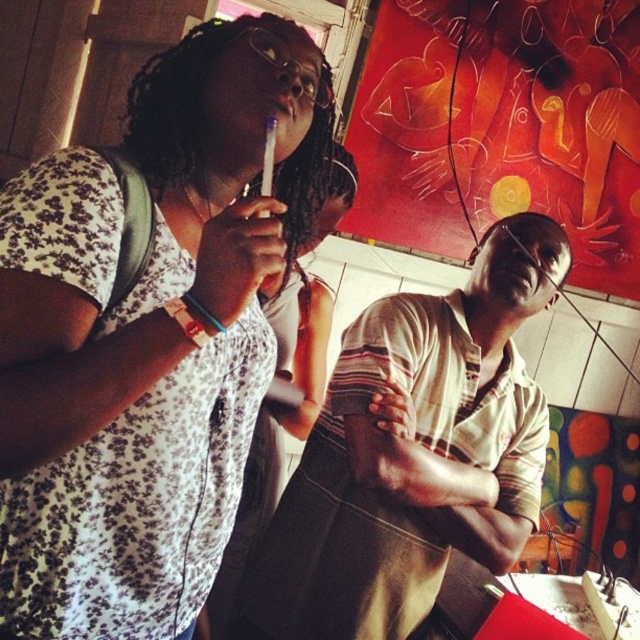
You are organizing a clothing donation drive and need to categorize items by size. You have two garments in front of you, the floral fabric dress at upper left and the matte black shirt at center. Based on their thickness, which one should you place in the small size section?

The floral fabric dress at upper left is thinner than the matte black shirt at center, so it should be placed in the small size section.

You are a photographer trying to capture a candid shot of both the woman in the floral fabric dress at upper left and the other person in the scene. The minimum distance required for your camera to focus on both subjects clearly is 30 inches. Can you take the photo without moving either subject?

The two subjects are 28.23 inches apart, which is less than the camera minimum focusing distance of 30 inches. Therefore, you can take the photo without moving the subjects because they are close enough.

You are standing in the scene and want to reach both points, point (x=182, y=497) and point (x=294, y=100). Which point should you move towards first if you want to reach the one closer to you first?

Point (x=182, y=497) is closer to the viewer than point (x=294, y=100), so you should move towards point (x=182, y=497) first.